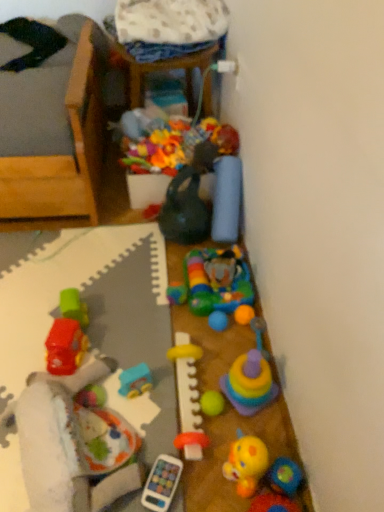
Where is `vacant space behind rubberized plastic baby rattle at lower left, the 11th toy when ordered from right to left`? vacant space behind rubberized plastic baby rattle at lower left, the 11th toy when ordered from right to left is located at coordinates (80, 296).